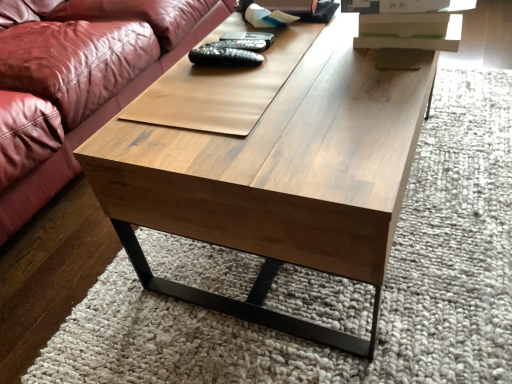
What are the coordinates of `vacant area that lies to the right of black matte remote at center, positioned as the second remote in bottom-to-top order` in the screenshot? It's located at (305, 48).